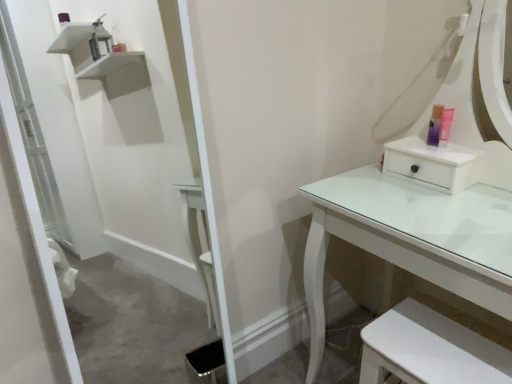
Find the location of `translucent plastic container at upper right`. translucent plastic container at upper right is located at coordinates (434, 125).

This screenshot has height=384, width=512. What do you see at coordinates (434, 125) in the screenshot?
I see `translucent plastic container at upper right` at bounding box center [434, 125].

What is the approximate height of translucent plastic container at upper right?

translucent plastic container at upper right is 4.96 inches tall.

I want to click on white glossy step stool at lower right, so click(430, 349).

The width and height of the screenshot is (512, 384). Describe the element at coordinates (430, 349) in the screenshot. I see `white glossy step stool at lower right` at that location.

Where is `translucent plastic container at upper right`? translucent plastic container at upper right is located at coordinates (434, 125).

Considering the positions of objects white glossy step stool at lower right and translucent plastic container at upper right in the image provided, who is more to the left, white glossy step stool at lower right or translucent plastic container at upper right?

From the viewer's perspective, white glossy step stool at lower right appears more on the left side.

Is white glossy step stool at lower right further to the viewer compared to translucent plastic container at upper right?

No, white glossy step stool at lower right is closer to the camera.

Considering the positions of point (376, 356) and point (438, 107), is point (376, 356) closer or farther from the camera than point (438, 107)?

Point (376, 356) appears to be closer to the viewer than point (438, 107).

From the image's perspective, is white glossy step stool at lower right located above or below translucent plastic container at upper right?

Based on their image positions, white glossy step stool at lower right is located beneath translucent plastic container at upper right.

From a real-world perspective, who is located lower, white glossy step stool at lower right or translucent plastic container at upper right?

white glossy step stool at lower right is physically lower.

Between white glossy step stool at lower right and translucent plastic container at upper right, which one has larger width?

With larger width is white glossy step stool at lower right.

Considering the relative sizes of white glossy step stool at lower right and translucent plastic container at upper right in the image provided, is white glossy step stool at lower right shorter than translucent plastic container at upper right?

In fact, white glossy step stool at lower right may be taller than translucent plastic container at upper right.

In the scene shown: Based on their sizes in the image, would you say white glossy step stool at lower right is bigger or smaller than translucent plastic container at upper right?

In the image, white glossy step stool at lower right appears to be larger than translucent plastic container at upper right.

Which is correct: white glossy step stool at lower right is inside translucent plastic container at upper right, or outside of it?

white glossy step stool at lower right is not enclosed by translucent plastic container at upper right.

Is white glossy step stool at lower right not close to translucent plastic container at upper right?

No, white glossy step stool at lower right is not far from translucent plastic container at upper right.

Is white glossy step stool at lower right oriented towards translucent plastic container at upper right?

No, white glossy step stool at lower right is not aimed at translucent plastic container at upper right.

Locate an element on the screen. step stool that is below the translucent plastic container at upper right (from the image's perspective) is located at coordinates (430, 349).

Is translucent plastic container at upper right at the right side of white glossy step stool at lower right?

Yes, translucent plastic container at upper right is to the right of white glossy step stool at lower right.

Is the position of translucent plastic container at upper right less distant than that of white glossy step stool at lower right?

No, translucent plastic container at upper right is further to the viewer.

Does point (443, 106) appear closer or farther from the camera than point (502, 361)?

Clearly, point (443, 106) is more distant from the camera than point (502, 361).

From the image's perspective, relative to white glossy step stool at lower right, is translucent plastic container at upper right above or below?

From the image's perspective, translucent plastic container at upper right appears above white glossy step stool at lower right.

From a real-world perspective, which is physically above, translucent plastic container at upper right or white glossy step stool at lower right?

In real-world perspective, translucent plastic container at upper right is above.

Looking at this image, considering the sizes of objects translucent plastic container at upper right and white glossy step stool at lower right in the image provided, who is wider, translucent plastic container at upper right or white glossy step stool at lower right?

white glossy step stool at lower right is wider.

Considering the sizes of objects translucent plastic container at upper right and white glossy step stool at lower right in the image provided, who is taller, translucent plastic container at upper right or white glossy step stool at lower right?

With more height is white glossy step stool at lower right.

Is translucent plastic container at upper right bigger than white glossy step stool at lower right?

Actually, translucent plastic container at upper right might be smaller than white glossy step stool at lower right.

Is translucent plastic container at upper right not within white glossy step stool at lower right?

Yes.

Is translucent plastic container at upper right positioned far away from white glossy step stool at lower right?

No, translucent plastic container at upper right is in close proximity to white glossy step stool at lower right.

Is translucent plastic container at upper right facing away from white glossy step stool at lower right?

translucent plastic container at upper right does not have its back to white glossy step stool at lower right.

How far apart are translucent plastic container at upper right and white glossy step stool at lower right?

translucent plastic container at upper right and white glossy step stool at lower right are 24.83 inches apart from each other.

The height and width of the screenshot is (384, 512). What are the coordinates of `toiletry above the white glossy step stool at lower right (from the image's perspective)` in the screenshot? It's located at (434, 125).

Identify the location of step stool that is below the translucent plastic container at upper right (from the image's perspective). (430, 349).

Find the location of a particular element. Image resolution: width=512 pixels, height=384 pixels. step stool lying in front of the translucent plastic container at upper right is located at coordinates (430, 349).